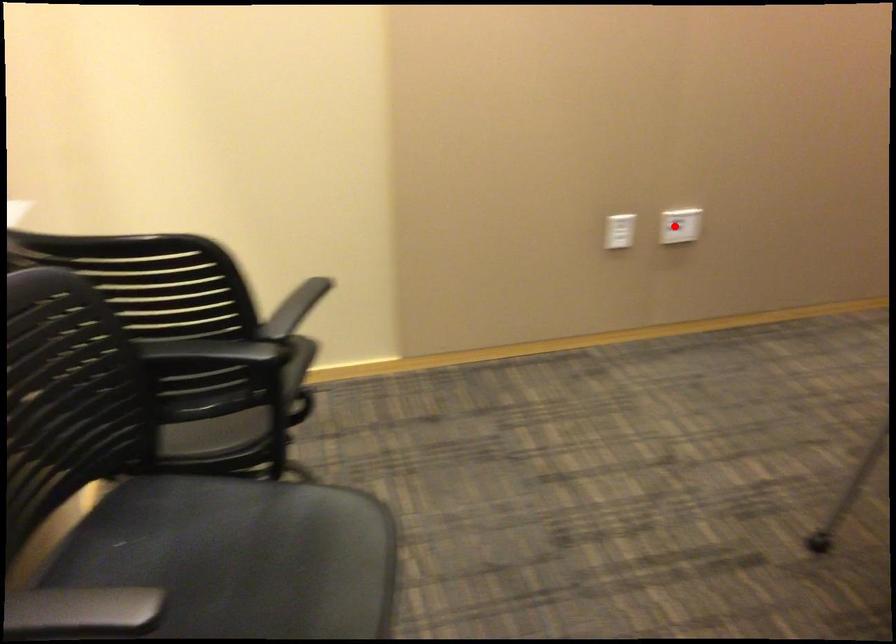
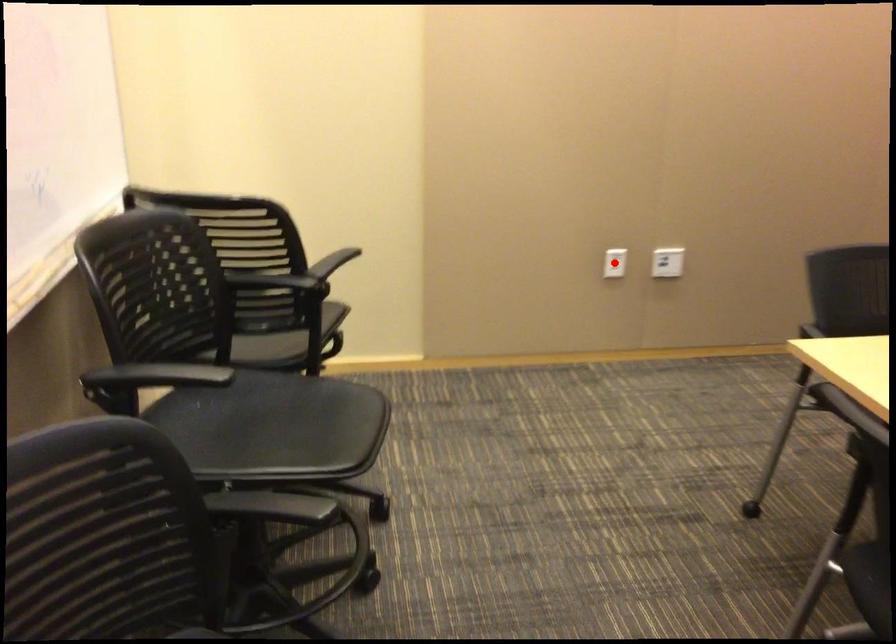
I am providing you with two images of the same scene from different viewpoints. A red point is marked on the first image and another point is marked on the second image. Are the points marked in image1 and image2 representing the same 3D position?

No